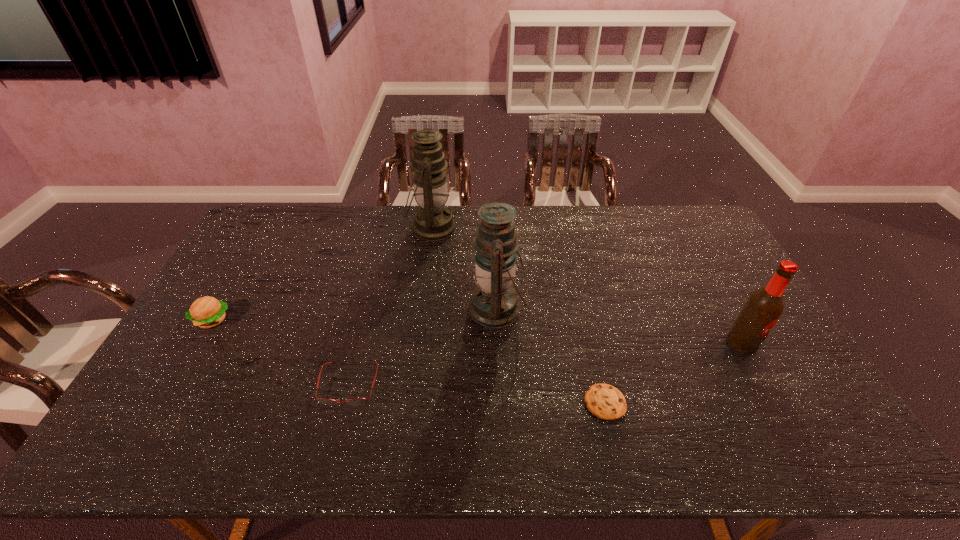
At what (x,y) coordinates should I click in order to perform the action: click on vacant region between the hamburger and the spectacles. Please return your answer as a coordinate pair (x, y). This screenshot has width=960, height=540. Looking at the image, I should click on (280, 352).

What are the coordinates of `vacant space in between the spectacles and the beer bottle` in the screenshot? It's located at (545, 364).

Where is `free spot between the left oil lamp and the third object from right to left`? free spot between the left oil lamp and the third object from right to left is located at coordinates (465, 268).

The image size is (960, 540). Identify the location of free area in between the right oil lamp and the rightmost object. (619, 326).

At what (x,y) coordinates should I click in order to perform the action: click on empty space between the spectacles and the third tallest object. Please return your answer as a coordinate pair (x, y). Looking at the image, I should click on (545, 364).

Where is `object identified as the second closest to the second shortest object`? This screenshot has width=960, height=540. object identified as the second closest to the second shortest object is located at coordinates (206, 312).

Select which object is the closest to the spectacles. Please provide its 2D coordinates. Your answer should be formatted as a tuple, i.e. [(x, y)], where the tuple contains the x and y coordinates of a point satisfying the conditions above.

[(494, 304)]

Identify the location of blank space that satisfies the following two spatial constraints: 1. on the front side of the farthest object; 2. on the right side of the beer bottle. This screenshot has width=960, height=540. (417, 343).

The image size is (960, 540). Find the location of `vacant space that satisfies the following two spatial constraints: 1. on the front side of the cookie; 2. on the left side of the right oil lamp`. vacant space that satisfies the following two spatial constraints: 1. on the front side of the cookie; 2. on the left side of the right oil lamp is located at coordinates (501, 402).

Where is `free region that satisfies the following two spatial constraints: 1. on the front side of the rightmost object; 2. on the left side of the hamburger`? This screenshot has height=540, width=960. free region that satisfies the following two spatial constraints: 1. on the front side of the rightmost object; 2. on the left side of the hamburger is located at coordinates (x=199, y=343).